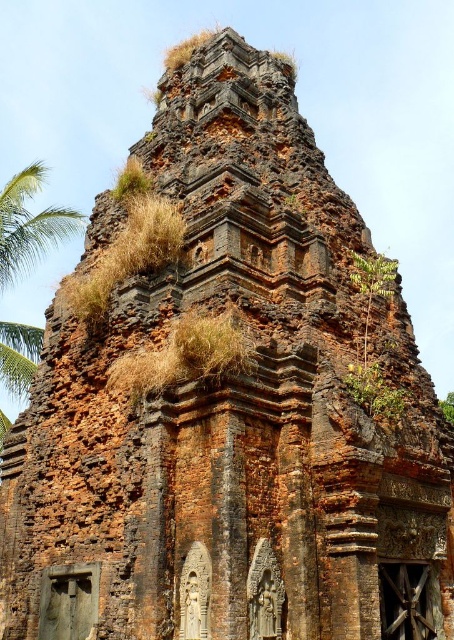
Which is in front, point (31, 348) or point (366, 269)?

Point (366, 269)

Does point (18, 332) come closer to viewer compared to point (376, 294)?

That is False.

This screenshot has width=454, height=640. In order to click on green leafy palm tree at upper left in this screenshot , I will do `click(29, 224)`.